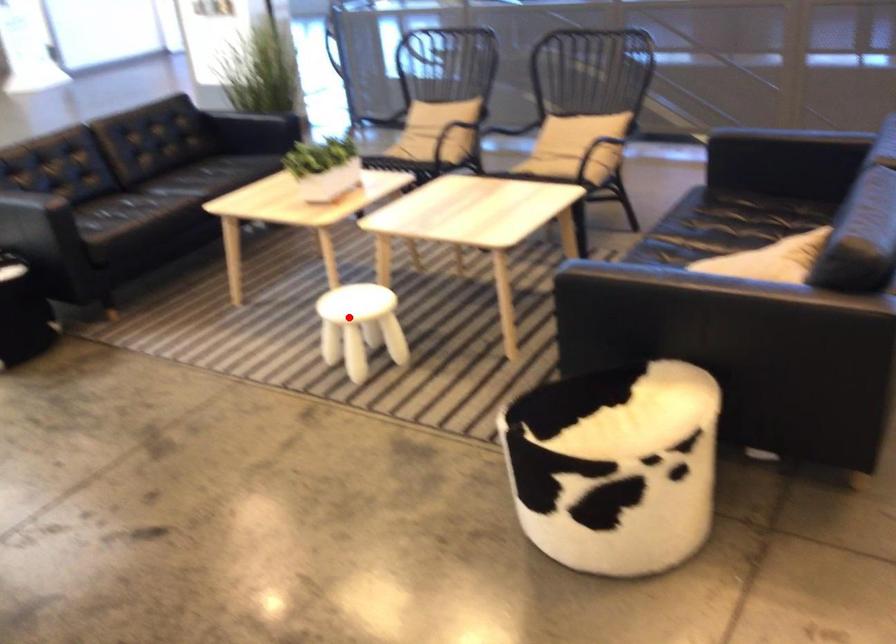
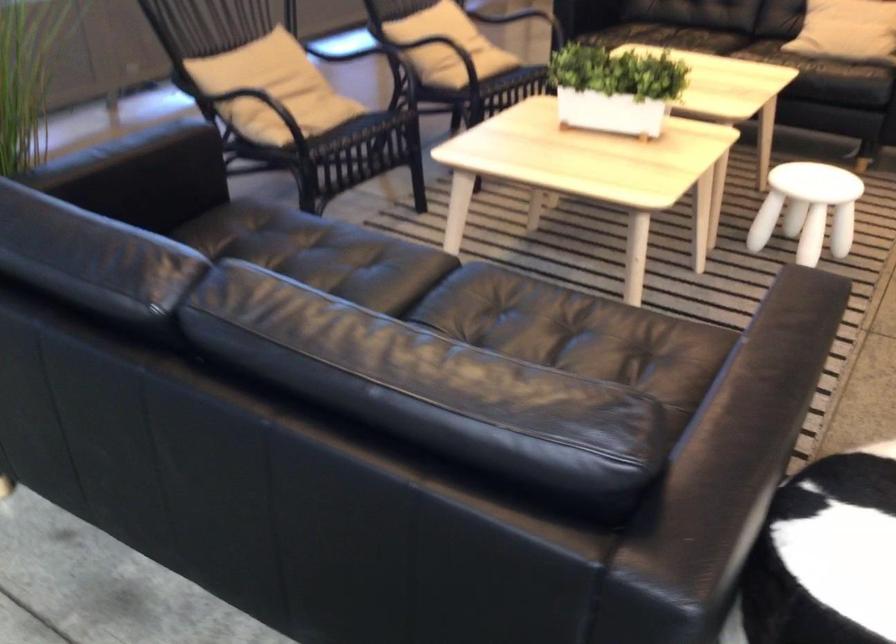
Locate, in the second image, the point that corresponds to the highlighted location in the first image.

(807, 209)